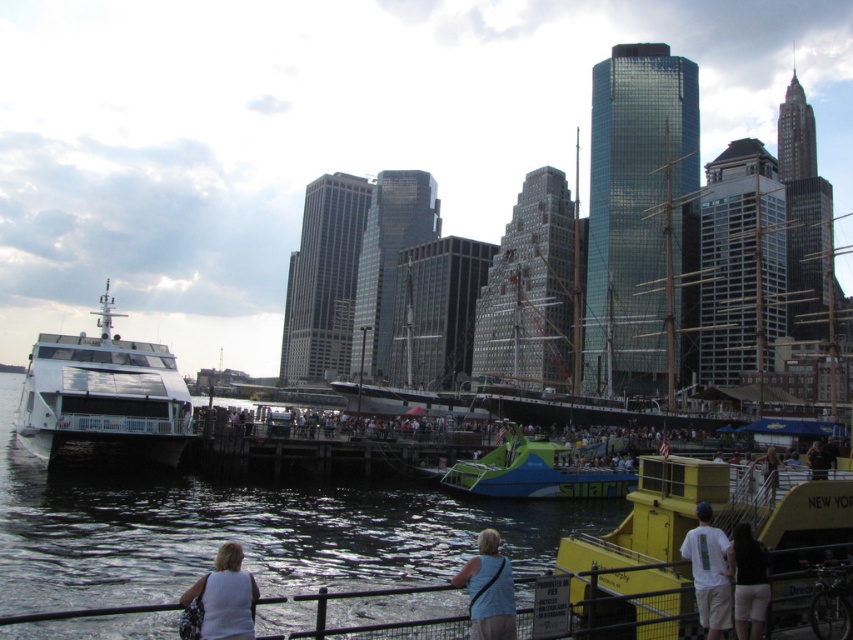
Question: Among these points, which one is nearest to the camera?

Choices:
 (A) (775, 493)
 (B) (468, 592)
 (C) (746, 584)
 (D) (451, 468)

Answer: (B)

Question: Is white glossy boat at left below dark brown shorts at lower right?

Choices:
 (A) yes
 (B) no

Answer: (B)

Question: From the image, what is the correct spatial relationship of green and blue plastic boat at center in relation to light blue fabric shirt at lower right?

Choices:
 (A) above
 (B) below

Answer: (B)

Question: Estimate the real-world distances between objects in this image. Which object is closer to the white cotton shirt at lower right?

Choices:
 (A) dark brown shorts at lower right
 (B) white glossy boat at left
 (C) light blue fabric shirt at lower right
 (D) white matte shirt at lower left

Answer: (A)

Question: Does white matte shirt at lower left have a greater width compared to light blue fabric at lower center?

Choices:
 (A) no
 (B) yes

Answer: (B)

Question: Which point appears closest to the camera in this image?

Choices:
 (A) (483, 618)
 (B) (708, 589)
 (C) (775, 490)

Answer: (A)